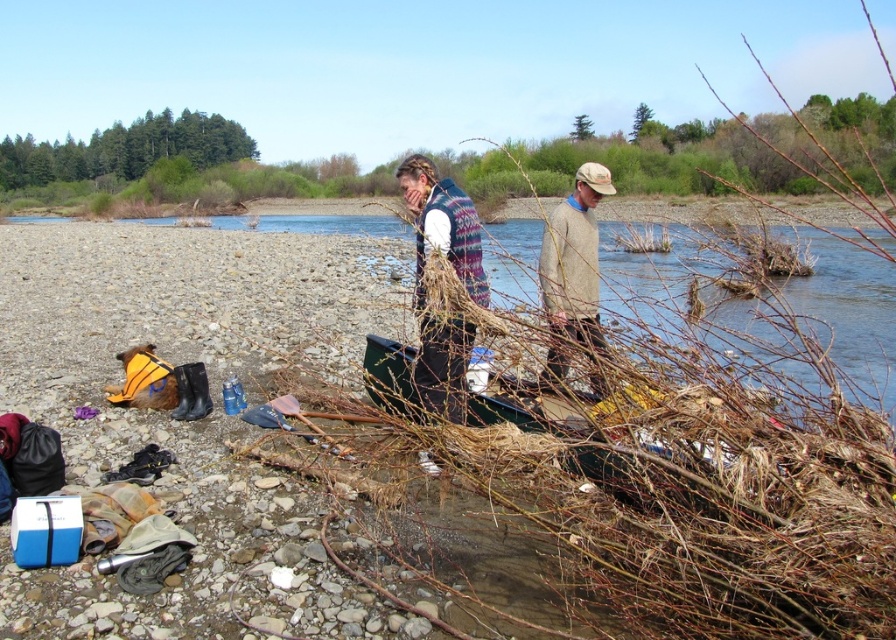
You are standing at the riverside and want to take a photo of both the cooler and the folded clothing. The cooler is at point [448,225] and the folded clothing is at point [490,413]. Which object should you focus on first to ensure both are in clear view?

You should focus on the cooler at point [448,225] first because it is closer to you than the folded clothing at point [490,413]. This ensures both objects will be in clear view when focused on the closer one.

You are packing for a day trip to the riverside and have two sweaters with you. You have a knitted sweater at center and a light brown sweater at center. Your backpack has a height limit of 15 inches. Which sweater can you fit vertically in your backpack without folding?

The light brown sweater at center is shorter than the knitted sweater at center, so the light brown sweater at center can fit vertically in the backpack without folding if its height is under 15 inches.

Based on the photo, you are standing at the point marked by the coordinates point (442,227) in the image. Which object is right in front of you?

The knitted sweater at center is located at point (442,227), so the object right in front of you is the knitted sweater at center.